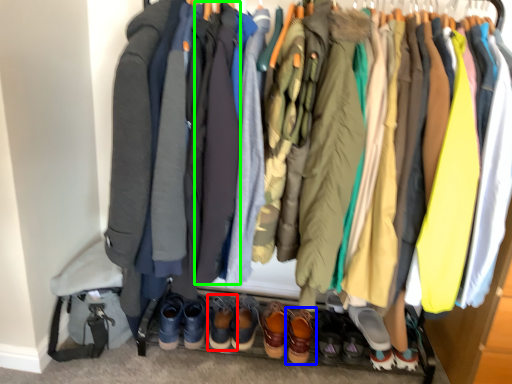
Question: Which is nearer to the footwear (highlighted by a red box)? footwear (highlighted by a blue box) or robe (highlighted by a green box).

Choices:
 (A) footwear
 (B) robe

Answer: (A)